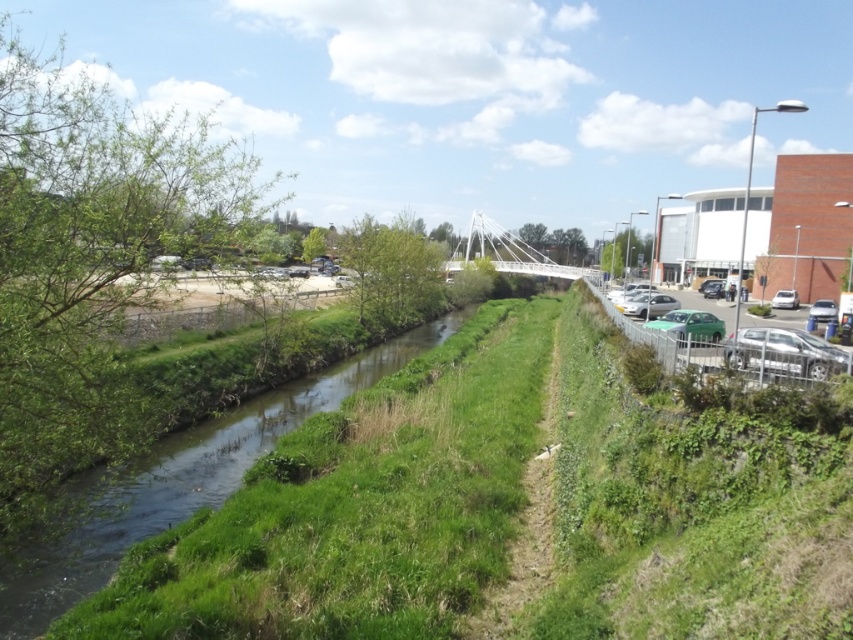
Question: Which of the following is the closest to the observer?

Choices:
 (A) white glossy sedan at right
 (B) silver metallic car at right

Answer: (B)

Question: In this image, where is silver metallic car at right located relative to white glossy sedan at right?

Choices:
 (A) left
 (B) right

Answer: (A)

Question: Which object appears farthest from the camera in this image?

Choices:
 (A) white glossy sedan at right
 (B) silver metallic car at right
 (C) silver metallic car at center-right
 (D) green matte car at right

Answer: (A)

Question: Among these points, which one is farthest from the camera?

Choices:
 (A) (680, 330)
 (B) (798, 352)

Answer: (A)

Question: Is green matte car at right bigger than metallic silver car at right?

Choices:
 (A) no
 (B) yes

Answer: (B)

Question: Is green grassy stream at center positioned before metallic silver car at right?

Choices:
 (A) no
 (B) yes

Answer: (B)